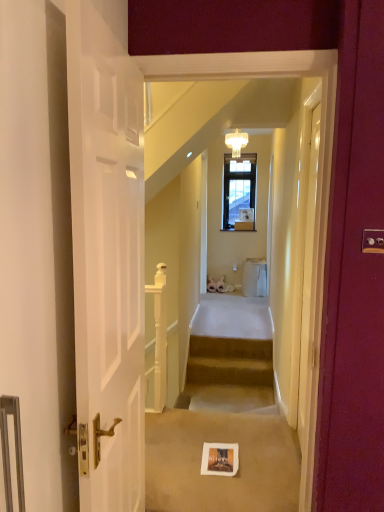
The width and height of the screenshot is (384, 512). What do you see at coordinates (236, 142) in the screenshot? I see `clear glass chandelier at upper center` at bounding box center [236, 142].

What do you see at coordinates (159, 340) in the screenshot? The height and width of the screenshot is (512, 384). I see `white glossy balustrade at center` at bounding box center [159, 340].

The height and width of the screenshot is (512, 384). I want to click on white matte door at left, which is counted as the 1th door, starting from the left, so click(x=107, y=253).

At what (x,y) coordinates should I click in order to perform the action: click on clear glass chandelier at upper center. Please return your answer as a coordinate pair (x, y). This screenshot has width=384, height=512. Looking at the image, I should click on (236, 142).

Which object is further away from the camera taking this photo, white matte door at left, the second door viewed from the back, or white glossy balustrade at center?

white glossy balustrade at center is further from the camera.

From a real-world perspective, between white matte door at left, acting as the second door starting from the right, and white glossy balustrade at center, who is vertically higher?

In real-world perspective, white matte door at left, acting as the second door starting from the right, is above.

Considering the relative sizes of white matte door at left, the second door viewed from the back, and white glossy balustrade at center in the image provided, is white matte door at left, the second door viewed from the back, smaller than white glossy balustrade at center?

No, white matte door at left, the second door viewed from the back, is not smaller than white glossy balustrade at center.

Measure the distance between white matte door at left, which is counted as the 1th door, starting from the left, and white glossy balustrade at center.

white matte door at left, which is counted as the 1th door, starting from the left, is 1.70 meters away from white glossy balustrade at center.

Is white glossy balustrade at center taller than white matte door at left, acting as the second door starting from the right?

No.

At what (x,y) coordinates should I click in order to perform the action: click on the 2nd door above the white glossy balustrade at center (from the image's perspective). Please return your answer as a coordinate pair (x, y). Looking at the image, I should click on (107, 253).

Could you tell me if white glossy balustrade at center is turned towards white matte door at left, which is counted as the 1th door, starting from the left?

No, white glossy balustrade at center is not facing towards white matte door at left, which is counted as the 1th door, starting from the left.

Which of these two, white glossy balustrade at center or white matte door at left, the 1th door viewed from the front, is smaller?

With smaller size is white glossy balustrade at center.

Is white glossy door at upper center, placed as the second door when sorted from front to back, taller or shorter than white matte door at left, which is counted as the 1th door, starting from the left?

In the image, white glossy door at upper center, placed as the second door when sorted from front to back, appears to be shorter than white matte door at left, which is counted as the 1th door, starting from the left.

How much distance is there between white glossy door at upper center, the second door positioned from the left, and white matte door at left, acting as the second door starting from the right?

white glossy door at upper center, the second door positioned from the left, is 88.20 centimeters from white matte door at left, acting as the second door starting from the right.

From a real-world perspective, which is physically above, white glossy door at upper center, the second door positioned from the left, or white matte door at left, which is counted as the 1th door, starting from the left?

white matte door at left, which is counted as the 1th door, starting from the left, from a real-world perspective.

In the scene shown: Considering the sizes of objects white glossy door at upper center, placed as the second door when sorted from front to back, and white matte door at left, which is counted as the 1th door, starting from the left, in the image provided, who is bigger, white glossy door at upper center, placed as the second door when sorted from front to back, or white matte door at left, which is counted as the 1th door, starting from the left,?

With larger size is white matte door at left, which is counted as the 1th door, starting from the left.

Can you tell me how much white glossy door at upper center, placed as the second door when sorted from front to back, and white glossy balustrade at center differ in facing direction?

180 degrees separate the facing orientations of white glossy door at upper center, placed as the second door when sorted from front to back, and white glossy balustrade at center.

Which of these two, white glossy door at upper center, the second door positioned from the left, or white glossy balustrade at center, is smaller?

Smaller between the two is white glossy balustrade at center.

Relative to white glossy balustrade at center, is white glossy door at upper center, the second door positioned from the left, in front or behind?

white glossy door at upper center, the second door positioned from the left, is in front of white glossy balustrade at center.

Does white glossy door at upper center, the first door when ordered from back to front, turn towards white glossy balustrade at center?

No, white glossy door at upper center, the first door when ordered from back to front, is not oriented towards white glossy balustrade at center.

Who is bigger, clear glass chandelier at upper center or beige carpeted stairs at center?

beige carpeted stairs at center is bigger.

Is clear glass chandelier at upper center shorter than beige carpeted stairs at center?

No, clear glass chandelier at upper center is not shorter than beige carpeted stairs at center.

Consider the image. Is white glossy balustrade at center behind clear glass chandelier at upper center?

No, it is in front of clear glass chandelier at upper center.

Is white glossy balustrade at center wider or thinner than clear glass chandelier at upper center?

In the image, white glossy balustrade at center appears to be more narrow than clear glass chandelier at upper center.

Identify the location of light fixture above the white glossy balustrade at center (from the image's perspective). (236, 142).

Is white glossy door at upper center, the first door from the right, thinner than beige carpeted stairs at center?

Yes, white glossy door at upper center, the first door from the right, is thinner than beige carpeted stairs at center.

Considering the points (318, 104) and (264, 350), which point is behind, point (318, 104) or point (264, 350)?

The point (264, 350) is farther from the camera.

Is white glossy door at upper center, the first door when ordered from back to front, next to beige carpeted stairs at center and touching it?

No, white glossy door at upper center, the first door when ordered from back to front, is not in contact with beige carpeted stairs at center.

Measure the distance between white glossy door at upper center, placed as the second door when sorted from front to back, and beige carpeted stairs at center.

white glossy door at upper center, placed as the second door when sorted from front to back, and beige carpeted stairs at center are 5.75 feet apart from each other.

I want to click on the 2nd door above the white glossy balustrade at center (from the image's perspective), so tap(107, 253).

Locate an element on the screen. The image size is (384, 512). balustrade located on the right of white matte door at left, which is counted as the 1th door, starting from the left is located at coordinates (159, 340).

Which object lies further to the anchor point white matte door at left, the second door viewed from the back, clear glass chandelier at upper center or white glossy balustrade at center?

clear glass chandelier at upper center.

Estimate the real-world distances between objects in this image. Which object is closer to white matte door at left, the 1th door viewed from the front, beige carpeted stairs at center or white glossy door at upper center, placed as the second door when sorted from front to back?

white glossy door at upper center, placed as the second door when sorted from front to back, is positioned closer to the anchor white matte door at left, the 1th door viewed from the front.

Estimate the real-world distances between objects in this image. Which object is closer to beige carpeted stairs at center, white glossy door at upper center, the first door from the right, or white matte door at left, the second door viewed from the back?

white glossy door at upper center, the first door from the right, is closer to beige carpeted stairs at center.

When comparing their distances from clear glass chandelier at upper center, does beige carpeted stairs at center or white glossy balustrade at center seem closer?

The object closer to clear glass chandelier at upper center is white glossy balustrade at center.

When comparing their distances from beige carpeted stairs at center, does clear glass chandelier at upper center or white glossy balustrade at center seem further?

Based on the image, clear glass chandelier at upper center appears to be further to beige carpeted stairs at center.

Estimate the real-world distances between objects in this image. Which object is further from white matte door at left, the second door viewed from the back, white glossy door at upper center, the first door from the right, or clear glass chandelier at upper center?

Among the two, clear glass chandelier at upper center is located further to white matte door at left, the second door viewed from the back.

When comparing their distances from white matte door at left, the second door viewed from the back, does white glossy door at upper center, the first door from the right, or beige carpeted stairs at center seem further?

beige carpeted stairs at center.

Based on their spatial positions, is beige carpeted stairs at center or clear glass chandelier at upper center closer to white matte door at left, the 1th door viewed from the front?

Among the two, beige carpeted stairs at center is located nearer to white matte door at left, the 1th door viewed from the front.

I want to click on balustrade between white matte door at left, the 1th door viewed from the front, and beige carpeted stairs at center in the front-back direction, so click(159, 340).

Image resolution: width=384 pixels, height=512 pixels. I want to click on balustrade located between white matte door at left, which is counted as the 1th door, starting from the left, and clear glass chandelier at upper center in the depth direction, so click(159, 340).

At what (x,y) coordinates should I click in order to perform the action: click on balustrade between white glossy door at upper center, the second door positioned from the left, and clear glass chandelier at upper center from front to back. Please return your answer as a coordinate pair (x, y). The width and height of the screenshot is (384, 512). Looking at the image, I should click on (159, 340).

This screenshot has height=512, width=384. What are the coordinates of `door between white matte door at left, acting as the second door starting from the right, and beige carpeted stairs at center from front to back` in the screenshot? It's located at (309, 314).